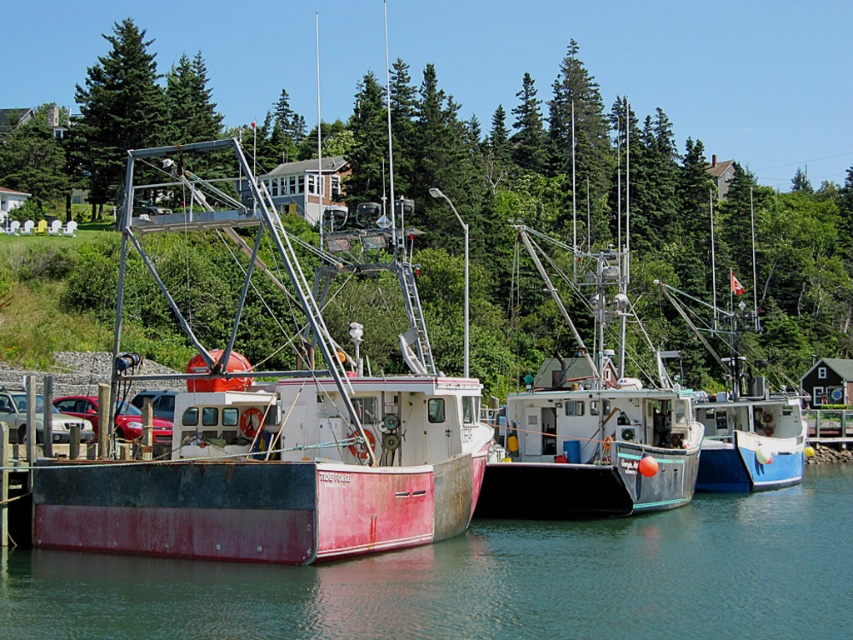
You are a photographer trying to capture the reflection of the green leafy tree at center in the smooth water at center. Based on the scene, can you confirm if the tree is reflected in the water?

The green leafy tree at center is positioned over smooth water at center, so its reflection should be visible in the water.

You are standing on the dock looking at the harbor. Which object is positioned higher up in the scene, the rusty metal boat at center or the green fir tree at upper left?

The green fir tree at upper left is positioned higher up in the scene than the rusty metal boat at center.

You are standing at the edge of the harbor looking at the boats. There are two points marked in the image. Which point is closer to you, point (666, 332) or point (792, 497)?

Point (666, 332) is closer to you because it is further to the viewer than point (792, 497).